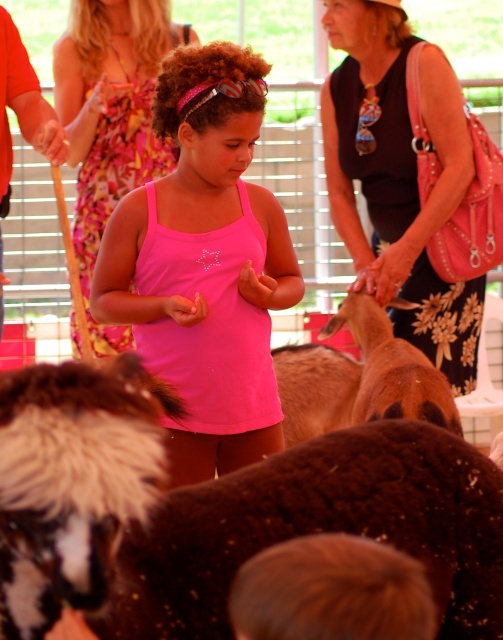
You are a photographer at the petting zoo and want to capture a clear shot of the girl in the pink matte tank top at center and the pink fabric dress at center. Which clothing item is positioned lower on her body?

The pink matte tank top at center is positioned lower on her body since it is below the pink fabric dress at center.

You are a photographer trying to capture a clear photo of the two dresses at the center of the scene. The camera can only focus on objects within a 30 cm width. Do both the black floral dress at center and the pink fabric dress at center fit within this width?

The black floral dress at center might be wider than the pink fabric dress at center. Since the camera requires both to be within 30 cm, it is uncertain if they will fit as their combined width may exceed the limit.

You are a photographer at the petting zoo and want to capture both the pink matte tank top at center and the pink fabric dress at center in a single photo. Which object should you position closer to the left side of the frame to ensure both are visible?

To ensure both the pink matte tank top at center and the pink fabric dress at center are visible, position the pink fabric dress at center closer to the left side of the frame since the pink matte tank top at center is already to the right of it.